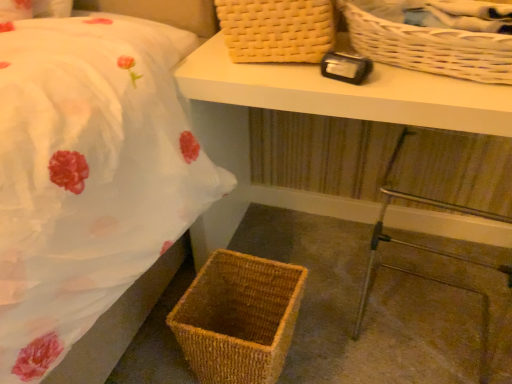
Find the location of a particular element. vacant region under woven wood table at center (from a real-world perspective) is located at coordinates (325, 252).